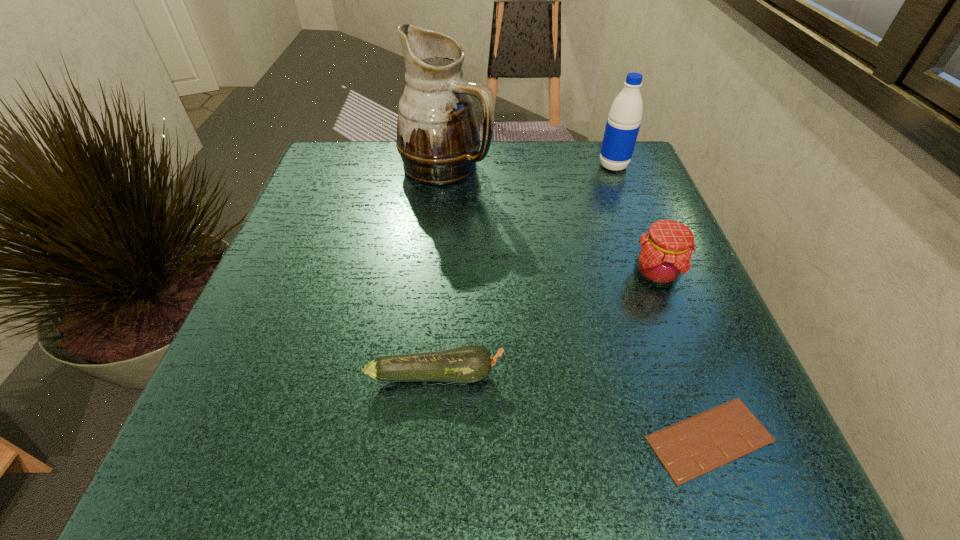
The image size is (960, 540). What are the coordinates of `free space in the image that satisfies the following two spatial constraints: 1. from the spout of the pitcher; 2. on the back side of the shortest object` in the screenshot? It's located at (420, 439).

Locate an element on the screen. Image resolution: width=960 pixels, height=540 pixels. vacant space that satisfies the following two spatial constraints: 1. on the front side of the third farthest object; 2. at the blossom end of the fourth farthest object is located at coordinates (695, 374).

Find the location of a particular element. This screenshot has height=540, width=960. free space that satisfies the following two spatial constraints: 1. on the back side of the third farthest object; 2. on the right side of the chocolate bar is located at coordinates (649, 274).

Identify the location of vacant space that satisfies the following two spatial constraints: 1. from the spout of the jam; 2. on the right side of the pitcher. The height and width of the screenshot is (540, 960). [x=436, y=274].

Where is `blank space that satisfies the following two spatial constraints: 1. on the back side of the chocolate bar; 2. on the right side of the third farthest object`? blank space that satisfies the following two spatial constraints: 1. on the back side of the chocolate bar; 2. on the right side of the third farthest object is located at coordinates (649, 274).

Find the location of a particular element. The height and width of the screenshot is (540, 960). blank area in the image that satisfies the following two spatial constraints: 1. on the front side of the second tallest object; 2. from the spout of the pitcher is located at coordinates (613, 166).